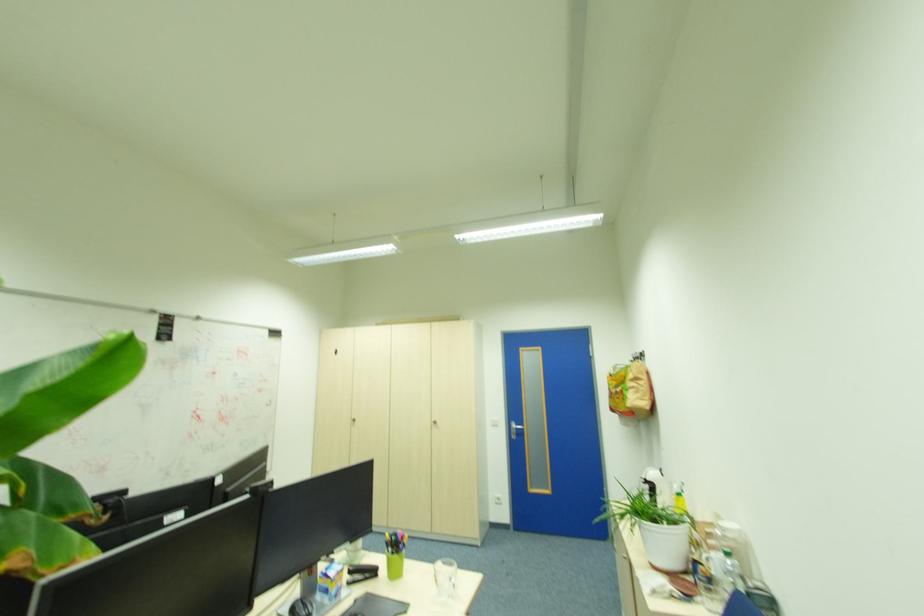
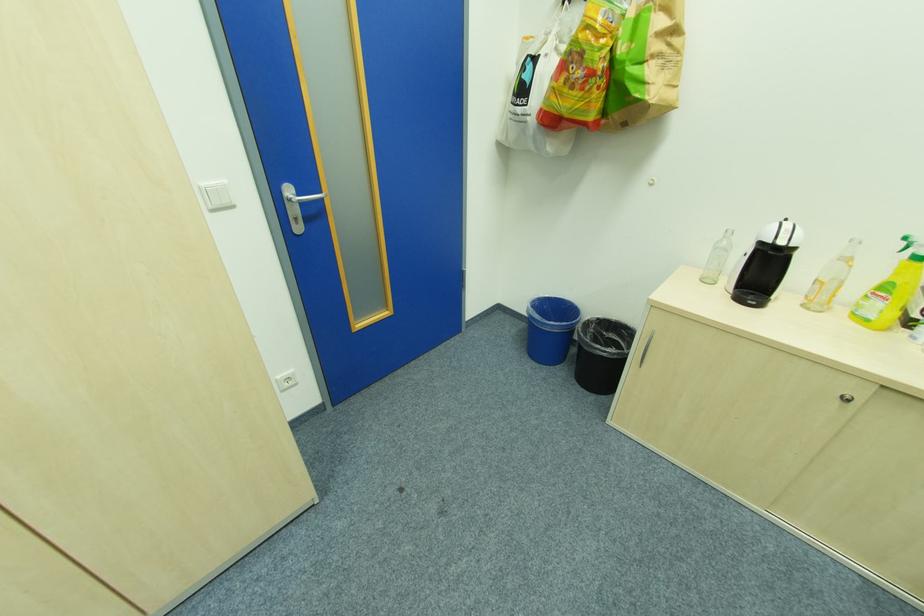
In the second image, find the point that corresponds to point (520, 427) in the first image.

(304, 196)